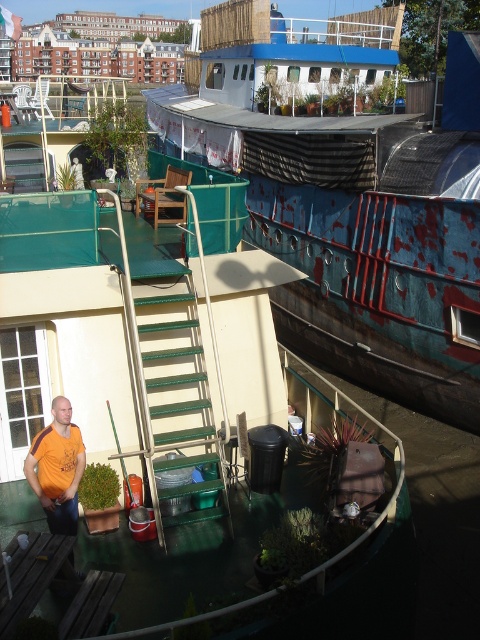
Which is more to the left, rusty metal boat at center or green metal stairs at center?

From the viewer's perspective, green metal stairs at center appears more on the left side.

Which is in front, point (333, 148) or point (183, 298)?

Positioned in front is point (183, 298).

Between point (334, 304) and point (196, 333), which one is positioned in front?

Point (196, 333) is more forward.

Where is `rusty metal boat at center`? rusty metal boat at center is located at coordinates (346, 209).

Which of these two, green metal stairs at center or orange t-shirt at lower left, stands taller?

green metal stairs at center is taller.

Is green metal stairs at center smaller than orange t-shirt at lower left?

Incorrect, green metal stairs at center is not smaller in size than orange t-shirt at lower left.

Locate an element on the screen. The image size is (480, 640). green metal stairs at center is located at coordinates (179, 406).

Where is `green metal stairs at center`? This screenshot has height=640, width=480. green metal stairs at center is located at coordinates (179, 406).

Is rusty metal boat at center smaller than orange t-shirt at lower left?

Actually, rusty metal boat at center might be larger than orange t-shirt at lower left.

Is point (331, 88) in front of point (72, 483)?

No.

Is point (240, 163) closer to camera compared to point (74, 524)?

No, (240, 163) is behind (74, 524).

Locate an element on the screen. rusty metal boat at center is located at coordinates (346, 209).